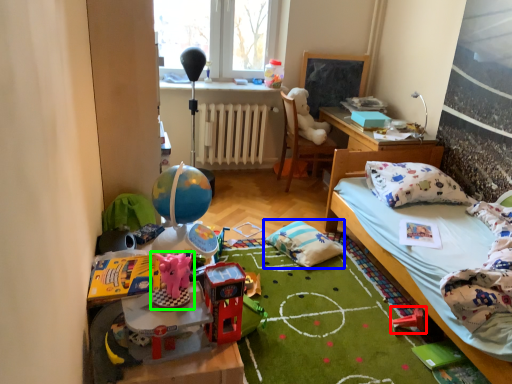
Question: Considering the real-world distances, which object is closest to toy (highlighted by a red box)? pillow (highlighted by a blue box) or toy (highlighted by a green box).

Choices:
 (A) pillow
 (B) toy

Answer: (A)